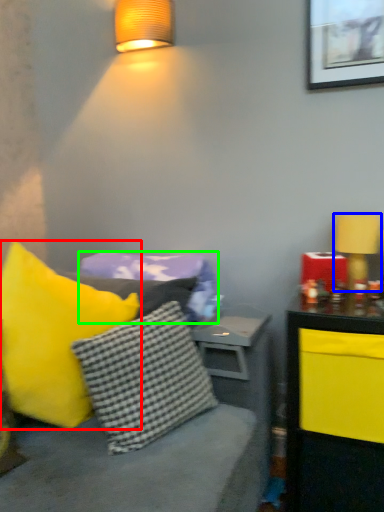
Question: Considering the real-world distances, which object is closest to pillow (highlighted by a red box)? table lamp (highlighted by a blue box) or pillow (highlighted by a green box).

Choices:
 (A) table lamp
 (B) pillow

Answer: (B)